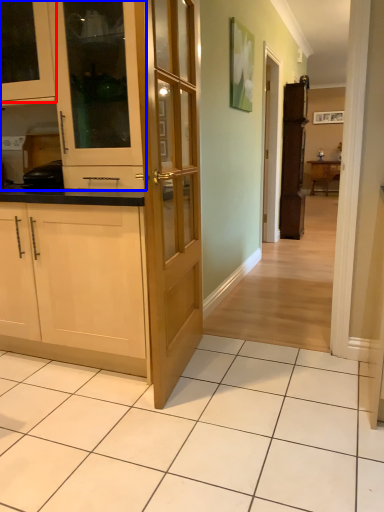
Question: Which of the following is the closest to the observer, cabinetry (highlighted by a red box) or cabinetry (highlighted by a blue box)?

Choices:
 (A) cabinetry
 (B) cabinetry

Answer: (B)